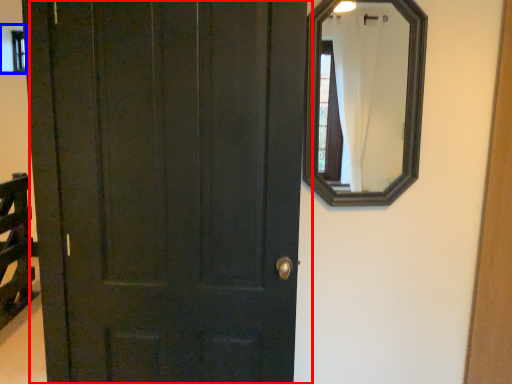
Question: Which point is closer to the camera, door (highlighted by a red box) or window (highlighted by a blue box)?

Choices:
 (A) door
 (B) window

Answer: (A)